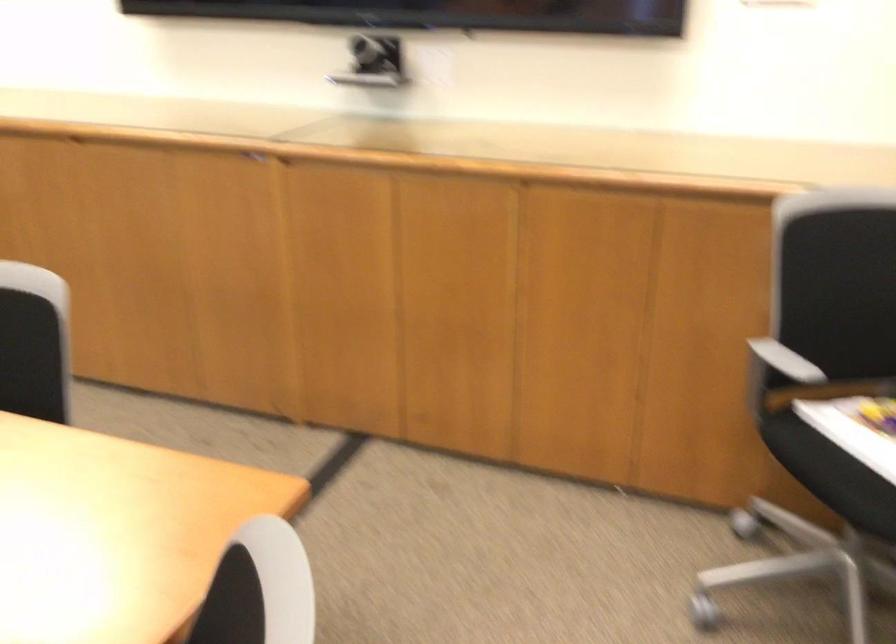
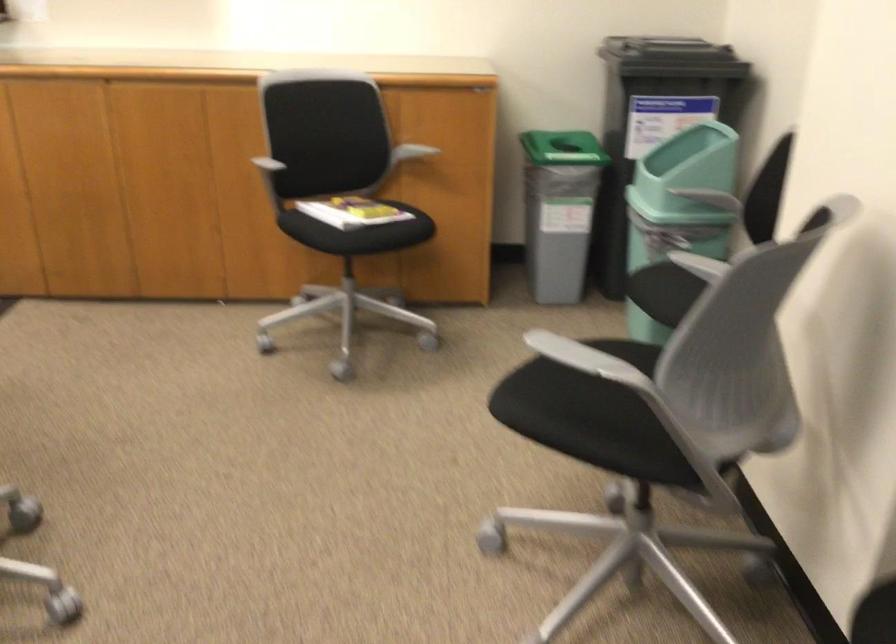
The point at (695, 297) is marked in the first image. Where is the corresponding point in the second image?

(236, 149)